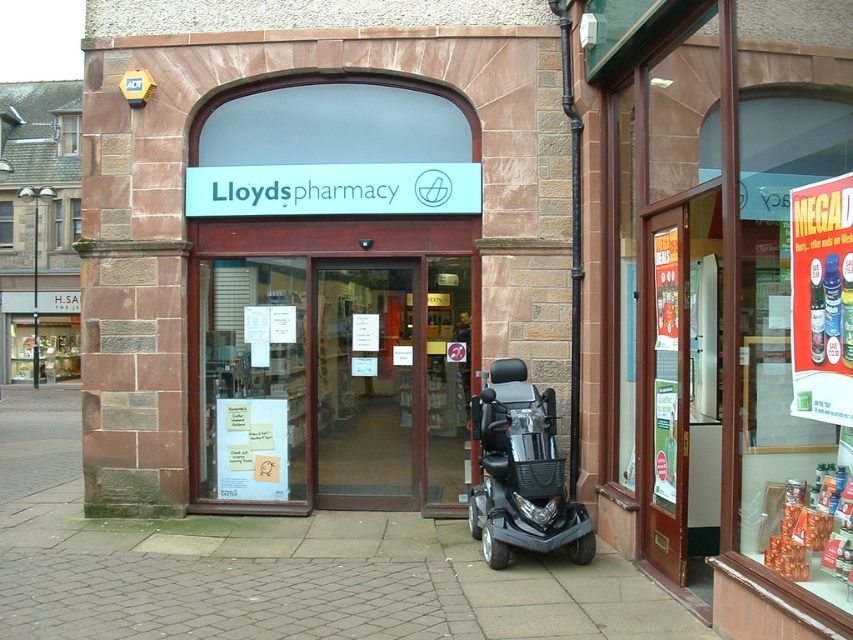
Is point (329, 499) closer to viewer compared to point (485, 509)?

No, it is behind (485, 509).

This screenshot has width=853, height=640. I want to click on transparent glass door at center, so click(x=364, y=385).

Does gray brick pavement at center have a lesser height compared to transparent glass door at center?

Indeed, gray brick pavement at center has a lesser height compared to transparent glass door at center.

Between gray brick pavement at center and transparent glass door at center, which one has more height?

transparent glass door at center

Identify the location of gray brick pavement at center. (277, 566).

The width and height of the screenshot is (853, 640). Find the location of `gray brick pavement at center`. gray brick pavement at center is located at coordinates (277, 566).

Can you confirm if gray brick pavement at center is wider than black plastic mobility scooter at lower center?

Yes.

Describe the element at coordinates (277, 566) in the screenshot. I see `gray brick pavement at center` at that location.

Image resolution: width=853 pixels, height=640 pixels. I want to click on gray brick pavement at center, so click(277, 566).

Where is `gray brick pavement at center`? This screenshot has width=853, height=640. gray brick pavement at center is located at coordinates (277, 566).